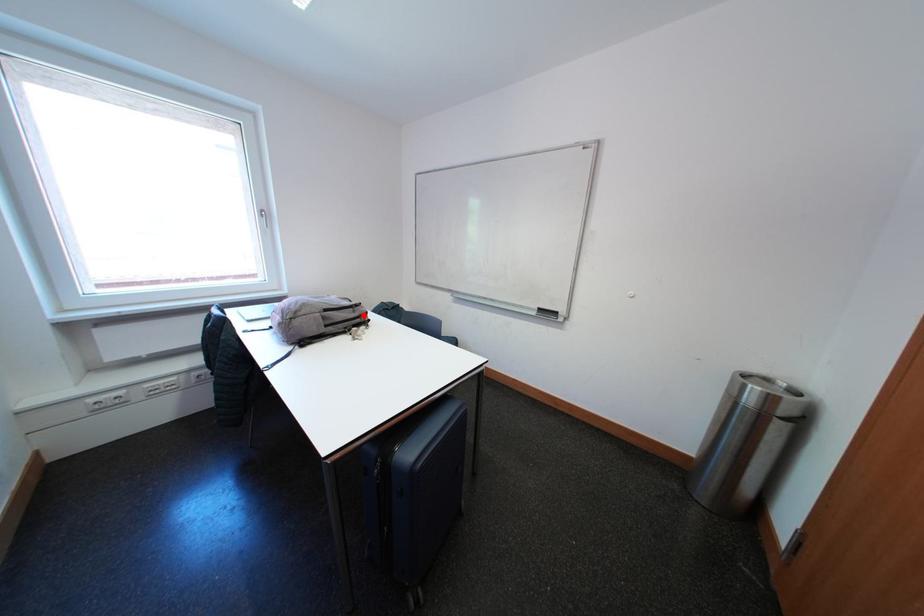
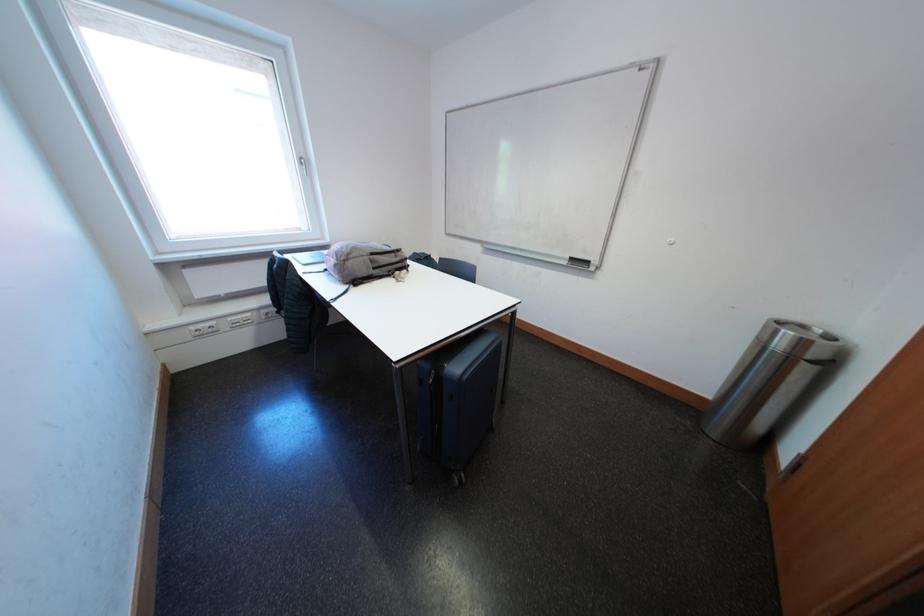
Where in the second image is the point corresponding to the highlighted location from the first image?

(406, 261)